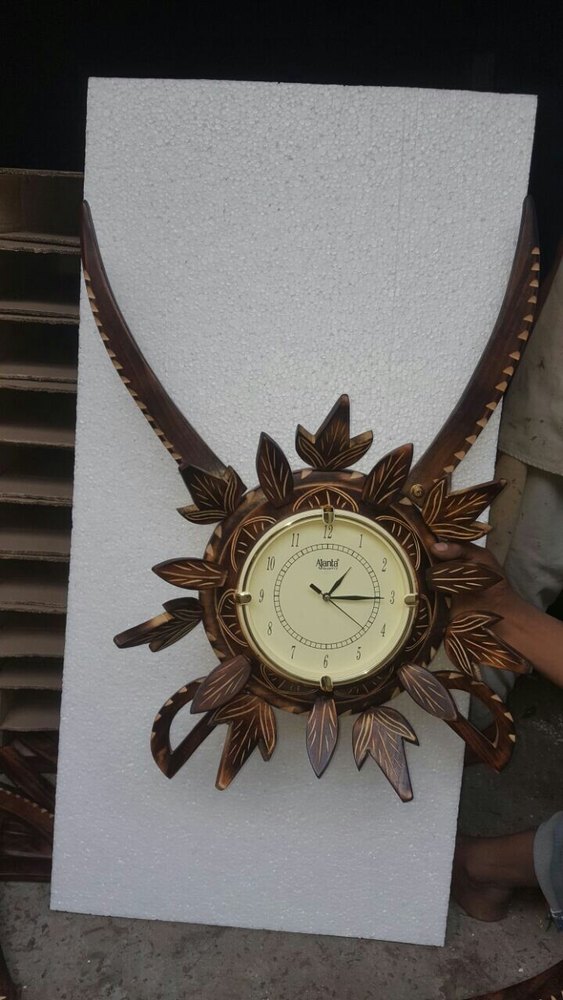
At what (x,y) coordinates should I click in order to perform the action: click on clock face. Please return your answer as a coordinate pair (x, y). This screenshot has width=563, height=1000. Looking at the image, I should click on (321, 622).